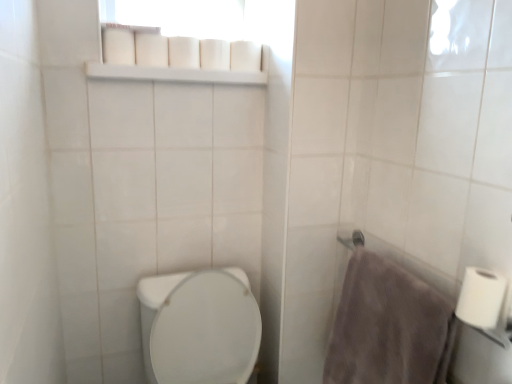
Find the location of a particular element. The image size is (512, 384). free spot behind white matte toilet paper at right, positioned as the 3th toilet paper in top-to-bottom order is located at coordinates (428, 283).